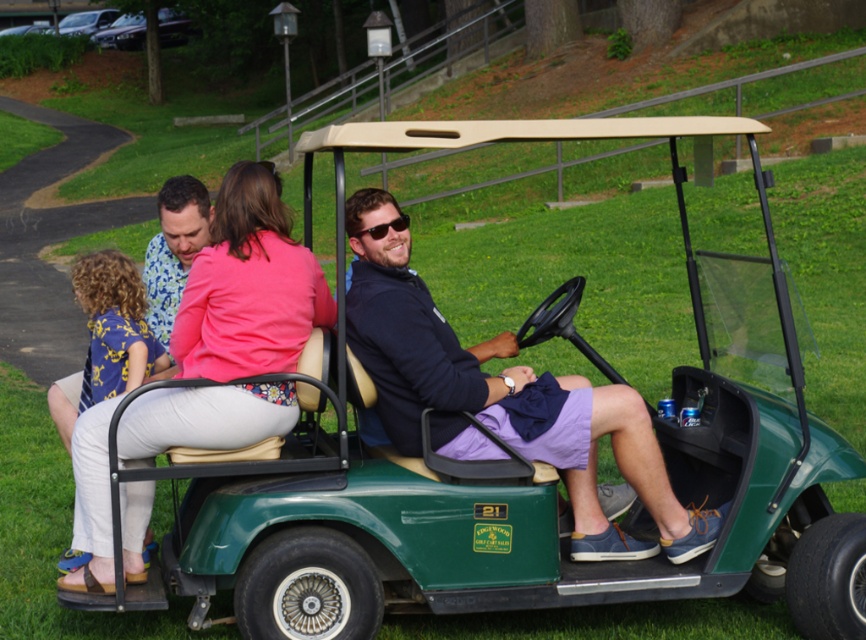
You are a GUI agent. You are given a task and a screenshot of the screen. Output one action in this format:
    pyautogui.click(x=<x>, y=<y>)
    Task: Click on the matte green golf cart at center
    
    Given the screenshot: What is the action you would take?
    pyautogui.click(x=508, y=406)

Between point (383, 332) and point (357, 234), which one is positioned in front?

Positioned in front is point (383, 332).

You are a GUI agent. You are given a task and a screenshot of the screen. Output one action in this format:
    pyautogui.click(x=<x>, y=<y>)
    Task: Click on the matte green golf cart at center
    The height and width of the screenshot is (640, 866).
    Given the screenshot: What is the action you would take?
    pyautogui.click(x=508, y=406)

Where is `matte green golf cart at center`? The height and width of the screenshot is (640, 866). matte green golf cart at center is located at coordinates (508, 406).

Is pink fabric shirt at upper center thinner than sunglasses at center?

In fact, pink fabric shirt at upper center might be wider than sunglasses at center.

Between pink fabric shirt at upper center and sunglasses at center, which one has less height?

With less height is sunglasses at center.

Is point (141, 516) farther from camera compared to point (396, 224)?

No, it is not.

Where is `pink fabric shirt at upper center`? Image resolution: width=866 pixels, height=640 pixels. pink fabric shirt at upper center is located at coordinates click(x=249, y=285).

Measure the distance between point (380, 198) and camera.

They are 19.22 feet apart.

Who is more distant from viewer, (576, 506) or (223, 397)?

Point (576, 506)

Where is `matte green golf cart at center`? The height and width of the screenshot is (640, 866). matte green golf cart at center is located at coordinates (508, 406).